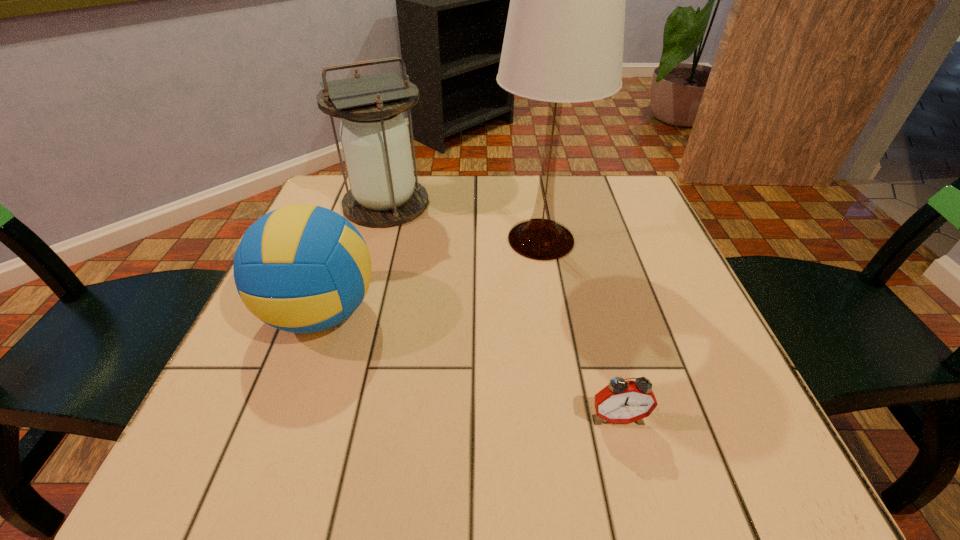
Locate an element on the screen. The height and width of the screenshot is (540, 960). table lamp is located at coordinates (563, 43).

The image size is (960, 540). What are the coordinates of `the third shortest object` in the screenshot? It's located at (383, 193).

In order to click on the third farthest object in this screenshot , I will do `click(302, 268)`.

The width and height of the screenshot is (960, 540). In order to click on the third tallest object in this screenshot , I will do `click(302, 268)`.

Where is `alarm clock`? Image resolution: width=960 pixels, height=540 pixels. alarm clock is located at coordinates (621, 401).

The height and width of the screenshot is (540, 960). Identify the location of the shortest object. [621, 401].

Locate an element on the screen. The image size is (960, 540). blank space located above the cylindrical shade of the tallest object is located at coordinates (334, 240).

At what (x,y) coordinates should I click in order to perform the action: click on vacant space positioned 0.060m above the cylindrical shade of the tallest object. Please return your answer as a coordinate pair (x, y). This screenshot has height=540, width=960. Looking at the image, I should click on (467, 240).

Where is `free location located above the cylindrical shade of the tallest object`? free location located above the cylindrical shade of the tallest object is located at coordinates (431, 240).

This screenshot has height=540, width=960. Find the location of `vacant space located on the front of the lantern`. vacant space located on the front of the lantern is located at coordinates (346, 343).